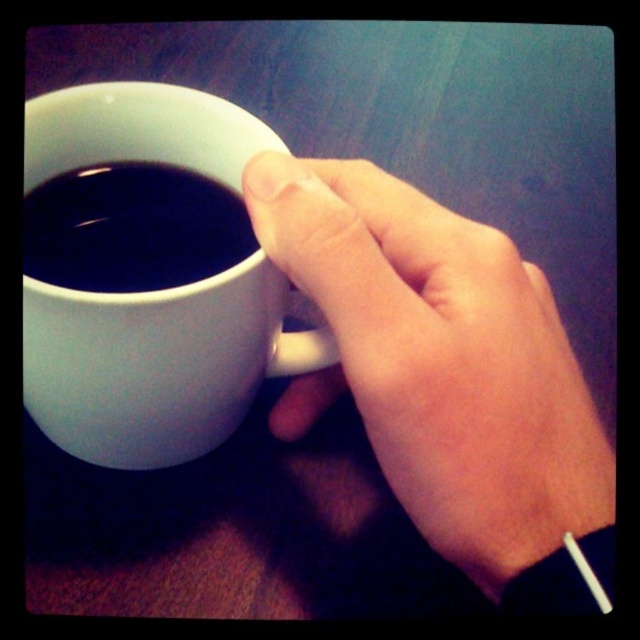
Question: Among these points, which one is farthest from the camera?

Choices:
 (A) (330, 369)
 (B) (109, 380)
 (C) (42, 227)

Answer: (A)

Question: Based on their relative distances, which object is farther from the black glossy mug at upper center?

Choices:
 (A) white matte mug at center
 (B) smooth skin hand at upper center

Answer: (B)

Question: Where is smooth skin hand at upper center located in relation to black glossy mug at upper center in the image?

Choices:
 (A) below
 (B) above

Answer: (A)

Question: Is the position of smooth skin hand at upper center more distant than that of white matte mug at center?

Choices:
 (A) yes
 (B) no

Answer: (B)

Question: Does white matte mug at center have a smaller size compared to black glossy mug at upper center?

Choices:
 (A) yes
 (B) no

Answer: (B)

Question: Which object is farther from the camera taking this photo?

Choices:
 (A) white matte mug at center
 (B) black glossy mug at upper center

Answer: (B)